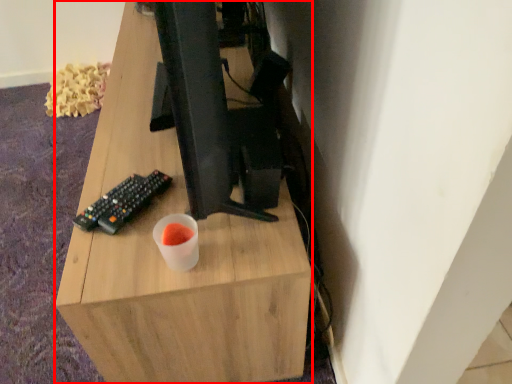
Question: From the image's perspective, what is the correct spatial positioning of desk (annotated by the red box) in reference to computer keyboard?

Choices:
 (A) below
 (B) above

Answer: (B)